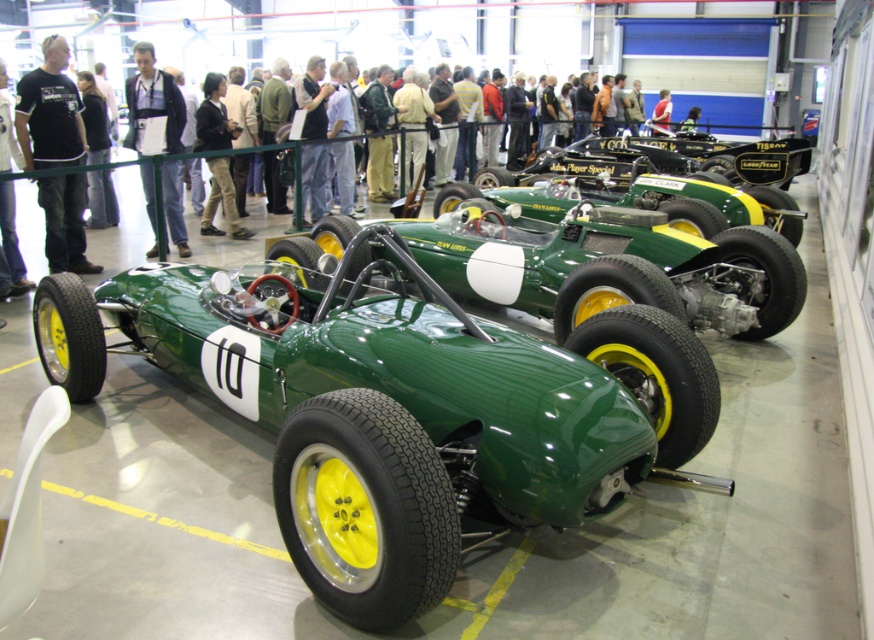
Which is more to the right, matte black jacket at center or dark brown leather jacket at center?

From the viewer's perspective, dark brown leather jacket at center appears more on the right side.

Is matte black jacket at center shorter than dark brown leather jacket at center?

Incorrect, matte black jacket at center's height does not fall short of dark brown leather jacket at center's.

This screenshot has height=640, width=874. Describe the element at coordinates (151, 100) in the screenshot. I see `matte black jacket at center` at that location.

I want to click on matte black jacket at center, so click(x=151, y=100).

Does black fabric jacket at upper left appear on the left side of white leather jacket at left?

Indeed, black fabric jacket at upper left is positioned on the left side of white leather jacket at left.

Between black fabric jacket at upper left and white leather jacket at left, which one has less height?

Standing shorter between the two is black fabric jacket at upper left.

Does point (91, 193) come in front of point (12, 257)?

No, it is not.

Image resolution: width=874 pixels, height=640 pixels. Identify the location of black fabric jacket at upper left. (94, 118).

Can you confirm if green matte sports car at center is positioned above white leather jacket at left?

Indeed, green matte sports car at center is positioned over white leather jacket at left.

Who is lower down, green matte sports car at center or white leather jacket at left?

white leather jacket at left is lower down.

Which is in front, point (699, 140) or point (4, 106)?

Point (4, 106) is in front.

At what (x,y) coordinates should I click in order to perform the action: click on green matte sports car at center. Please return your answer as a coordinate pair (x, y). The width and height of the screenshot is (874, 640). Looking at the image, I should click on pyautogui.click(x=657, y=160).